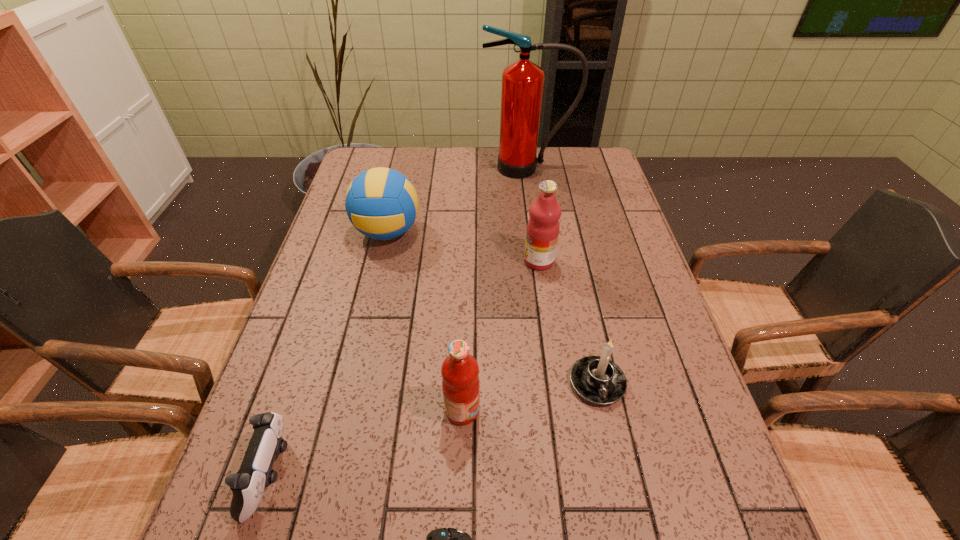
What are the coordinates of `free space between the volleyball and the shorter fruit juice` in the screenshot? It's located at (425, 321).

I want to click on vacant region between the second nearest object and the candle holder, so coord(434,428).

Where is `free space between the candle holder and the right fruit juice`? free space between the candle holder and the right fruit juice is located at coordinates (568, 322).

At what (x,y) coordinates should I click in order to perform the action: click on free space between the control and the shorter fruit juice. Please return your answer as a coordinate pair (x, y). This screenshot has height=540, width=960. Looking at the image, I should click on (367, 442).

The width and height of the screenshot is (960, 540). Identify the location of vacant space that is in between the left fruit juice and the candle holder. (530, 396).

Locate an element on the screen. Image resolution: width=960 pixels, height=540 pixels. the second closest object relative to the control is located at coordinates (460, 382).

Image resolution: width=960 pixels, height=540 pixels. Identify the location of the second closest object to the right fruit juice. (381, 203).

The width and height of the screenshot is (960, 540). I want to click on vacant space that satisfies the following two spatial constraints: 1. with a handle on the side of the fifth tallest object; 2. on the front label of the shorter fruit juice, so click(x=603, y=410).